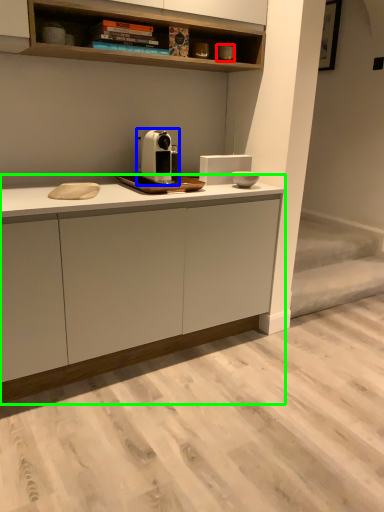
Question: Estimate the real-world distances between objects in this image. Which object is farther from appliance (highlighted by a red box), home appliance (highlighted by a blue box) or cabinetry (highlighted by a green box)?

Choices:
 (A) home appliance
 (B) cabinetry

Answer: (B)